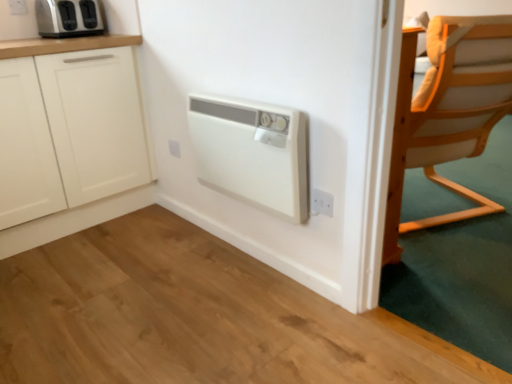
Question: Considering the relative positions of white plastic electric outlet at center, acting as the second electric outlet starting from the front, and white matte cabinet at left in the image provided, is white plastic electric outlet at center, acting as the second electric outlet starting from the front, in front of white matte cabinet at left?

Choices:
 (A) yes
 (B) no

Answer: (B)

Question: Is white plastic electric outlet at center, acting as the second electric outlet starting from the front, taller than white matte cabinet at left?

Choices:
 (A) no
 (B) yes

Answer: (A)

Question: Can you confirm if white plastic electric outlet at center, the second electric outlet in the bottom-to-top sequence, is shorter than white matte cabinet at left?

Choices:
 (A) no
 (B) yes

Answer: (B)

Question: Is white plastic electric outlet at center, arranged as the 2th electric outlet when viewed from the left, facing towards white matte cabinet at left?

Choices:
 (A) yes
 (B) no

Answer: (B)

Question: From a real-world perspective, does white plastic electric outlet at center, which is the 2th electric outlet in right-to-left order, sit lower than white matte cabinet at left?

Choices:
 (A) no
 (B) yes

Answer: (B)

Question: Looking at the image, does light wood chair at right seem bigger or smaller compared to white plastic electric outlet at center, which is the second electric outlet from back to front?

Choices:
 (A) small
 (B) big

Answer: (B)

Question: From the image's perspective, is light wood chair at right located above or below white plastic electric outlet at center, arranged as the 2th electric outlet when viewed from the left?

Choices:
 (A) below
 (B) above

Answer: (B)

Question: Considering their positions, is light wood chair at right located in front of or behind white plastic electric outlet at center, arranged as the 2th electric outlet when viewed from the left?

Choices:
 (A) front
 (B) behind

Answer: (A)

Question: From their relative heights in the image, would you say light wood chair at right is taller or shorter than white plastic electric outlet at center, acting as the second electric outlet starting from the front?

Choices:
 (A) tall
 (B) short

Answer: (A)

Question: Considering the positions of white plastic electric outlet at center, arranged as the 2th electric outlet when viewed from the left, and white plastic electric outlet at lower right, which is counted as the 3th electric outlet, starting from the left, in the image, is white plastic electric outlet at center, arranged as the 2th electric outlet when viewed from the left, wider or thinner than white plastic electric outlet at lower right, which is counted as the 3th electric outlet, starting from the left,?

Choices:
 (A) thin
 (B) wide

Answer: (B)

Question: From the image's perspective, is white plastic electric outlet at center, which is the second electric outlet from back to front, above or below white plastic electric outlet at lower right, which appears as the first electric outlet when viewed from the right?

Choices:
 (A) below
 (B) above

Answer: (B)

Question: Considering the positions of white plastic electric outlet at center, which ranks as the 2th electric outlet in top-to-bottom order, and white plastic electric outlet at lower right, the 1th electric outlet in the bottom-to-top sequence, in the image, is white plastic electric outlet at center, which ranks as the 2th electric outlet in top-to-bottom order, taller or shorter than white plastic electric outlet at lower right, the 1th electric outlet in the bottom-to-top sequence,?

Choices:
 (A) short
 (B) tall

Answer: (A)

Question: Is point pyautogui.click(x=179, y=145) positioned closer to the camera than point pyautogui.click(x=330, y=210)?

Choices:
 (A) closer
 (B) farther

Answer: (B)

Question: Relative to light wood chair at right, is satin silver toaster at upper left in front or behind?

Choices:
 (A) front
 (B) behind

Answer: (B)

Question: Does point (92, 21) appear closer or farther from the camera than point (409, 142)?

Choices:
 (A) farther
 (B) closer

Answer: (A)